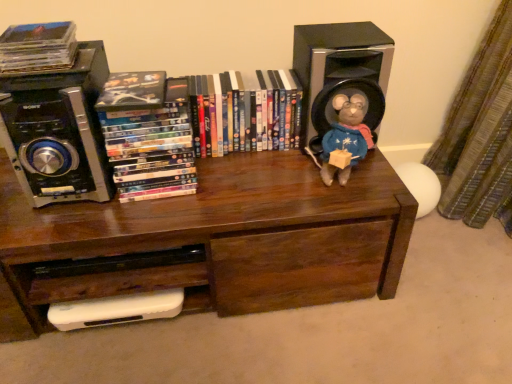
In order to click on empty space that is in between fuzzy fabric stuffed animal at upper right and matte plastic dvds at center, marked as the first book in a right-to-left arrangement in this screenshot , I will do `click(271, 167)`.